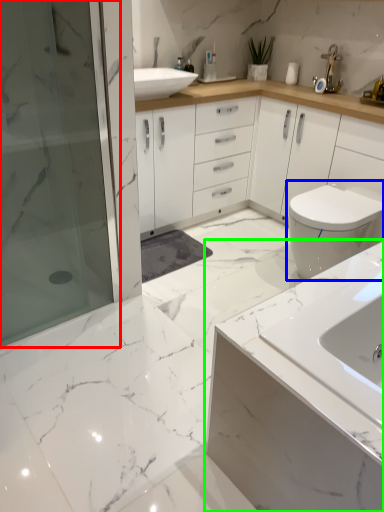
Question: Considering the real-world distances, which object is closest to shower door (highlighted by a red box)? toilet (highlighted by a blue box) or bathroom cabinet (highlighted by a green box).

Choices:
 (A) toilet
 (B) bathroom cabinet

Answer: (A)